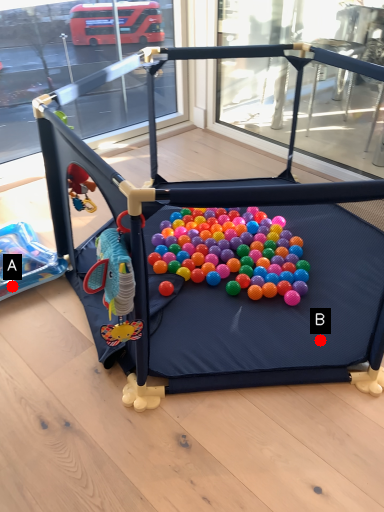
Question: Two points are circled on the image, labeled by A and B beside each circle. Which point is further to the camera?

Choices:
 (A) A is further
 (B) B is further

Answer: (A)